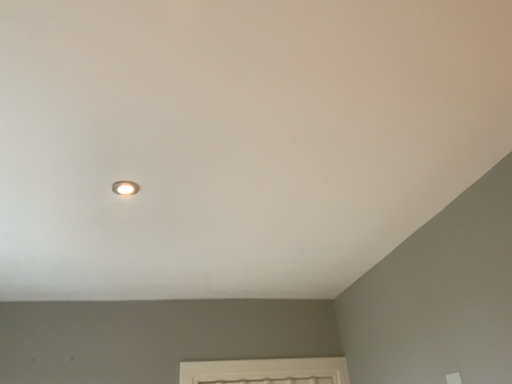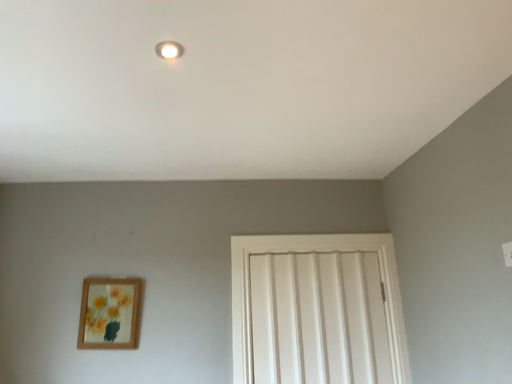
Question: Which way did the camera rotate in the video?

Choices:
 (A) rotated upward
 (B) rotated downward

Answer: (B)